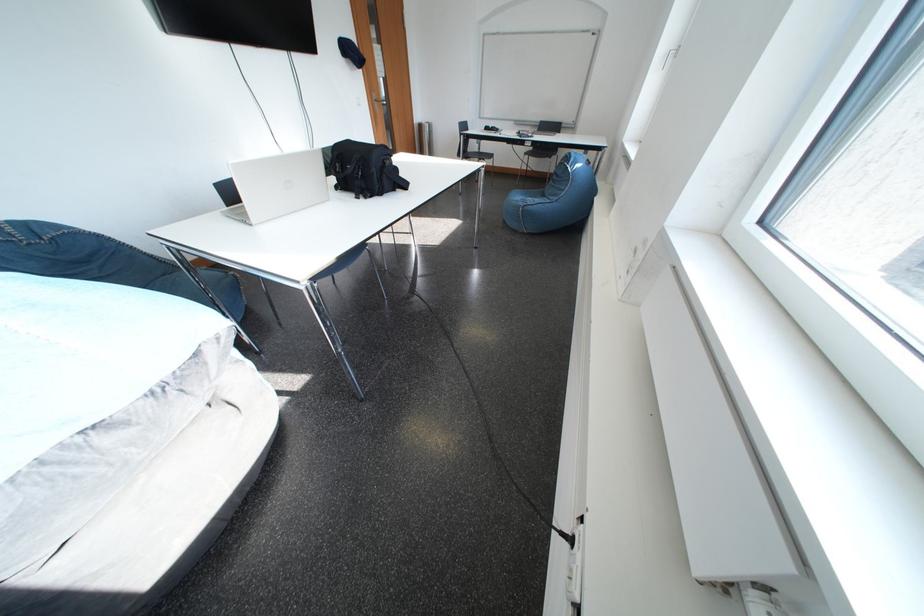
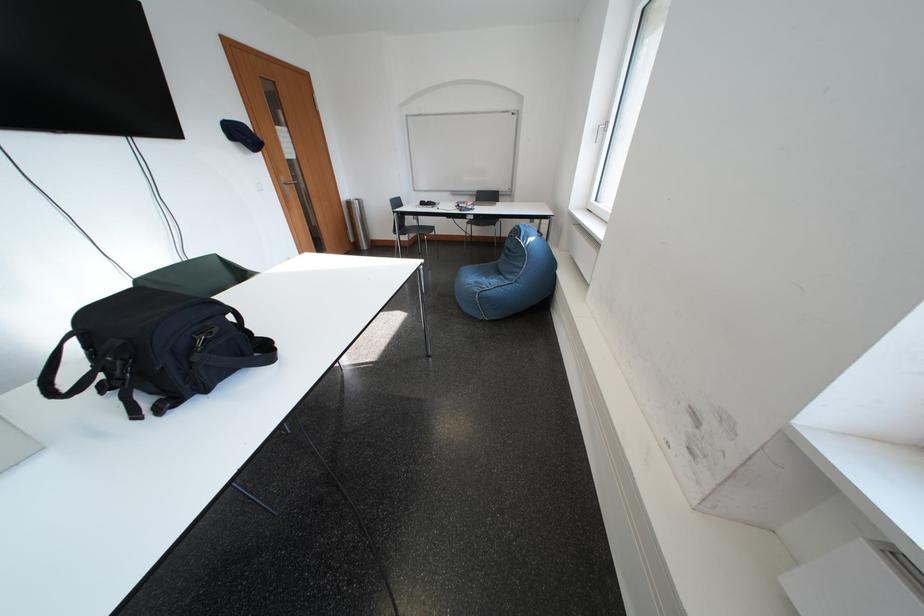
Where in the second image is the point corresponding to [432,129] from the first image?

(360, 207)